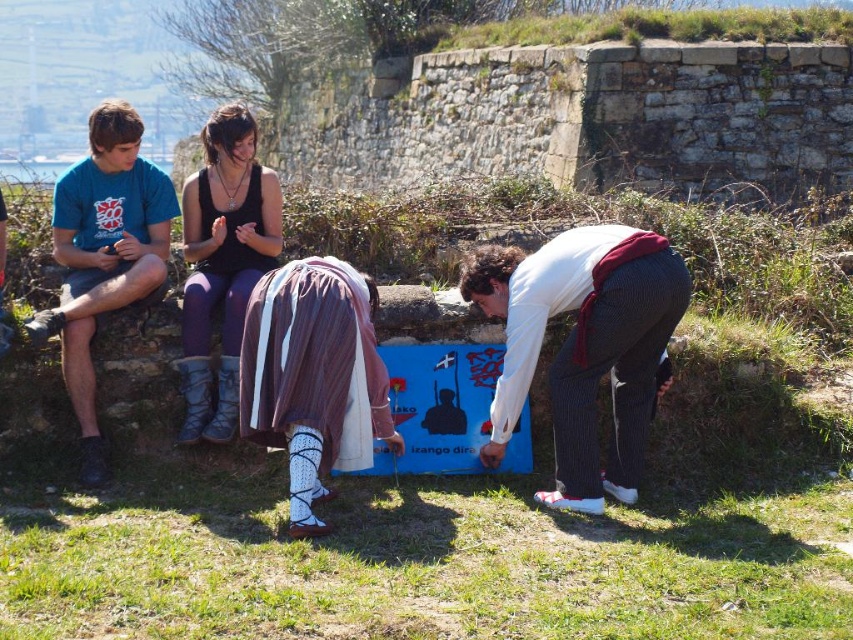
You are standing at the point with coordinates point (x=310, y=406) and want to move to the point with coordinates point (x=595, y=346). Given that there is a stone wall in the background and a blue poster on the ground, will you be able to walk directly to your destination without any obstacles?

Point (x=595, y=346) is behind point (x=310, y=406), so you will not be able to walk directly to your destination without obstacles because the stone wall or blue poster might block your path.

You are a photographer trying to capture a candid shot of the two people at the center of the scene. Since you want to focus on their clothing, you need to ensure that both the brown woven skirt at center and the matte black tank top at center are clearly visible. Given their sizes, which clothing item should you prioritize framing closer to the camera to ensure visibility?

The brown woven skirt at center occupies less space than the matte black tank top at center, so you should prioritize framing the brown woven skirt at center closer to the camera to ensure its smaller size is still visible in the photograph.

You are a photographer trying to capture a clear shot of both the brown woven skirt at center and the matte black tank top at center. Since you want both items to be visible in the photo, which one should you focus on first to ensure the other remains in the frame?

The brown woven skirt at center is in front of the matte black tank top at center, so you should focus on the matte black tank top at center first to ensure the brown woven skirt at center stays visible behind it.